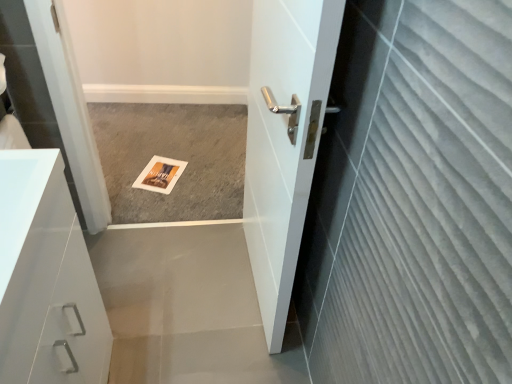
Question: Would you say white glossy cabinet at left is outside white glossy door at center?

Choices:
 (A) no
 (B) yes

Answer: (B)

Question: Is white glossy cabinet at left bigger than white glossy door at center?

Choices:
 (A) no
 (B) yes

Answer: (A)

Question: Are white glossy cabinet at left and white glossy door at center making contact?

Choices:
 (A) yes
 (B) no

Answer: (B)

Question: Is white glossy cabinet at left positioned far away from white glossy door at center?

Choices:
 (A) yes
 (B) no

Answer: (B)

Question: Could you tell me if white glossy cabinet at left is turned towards white glossy door at center?

Choices:
 (A) yes
 (B) no

Answer: (B)

Question: Considering their positions, is gray carpet at center located in front of or behind white glossy cabinet at left?

Choices:
 (A) behind
 (B) front

Answer: (A)

Question: Is gray carpet at center to the left or to the right of white glossy cabinet at left in the image?

Choices:
 (A) left
 (B) right

Answer: (B)

Question: From the image's perspective, is gray carpet at center located above or below white glossy cabinet at left?

Choices:
 (A) above
 (B) below

Answer: (A)

Question: From a real-world perspective, relative to white glossy cabinet at left, is gray carpet at center vertically above or below?

Choices:
 (A) below
 (B) above

Answer: (A)

Question: Is white glossy door at center to the left or to the right of gray carpet at center in the image?

Choices:
 (A) left
 (B) right

Answer: (B)

Question: In terms of height, does white glossy door at center look taller or shorter compared to gray carpet at center?

Choices:
 (A) short
 (B) tall

Answer: (B)

Question: Is white glossy door at center wider or thinner than gray carpet at center?

Choices:
 (A) thin
 (B) wide

Answer: (A)

Question: From a real-world perspective, is white glossy door at center positioned above or below gray carpet at center?

Choices:
 (A) below
 (B) above

Answer: (B)

Question: From their relative heights in the image, would you say white glossy cabinet at left is taller or shorter than white glossy door at center?

Choices:
 (A) tall
 (B) short

Answer: (B)

Question: Is white glossy cabinet at left situated inside white glossy door at center or outside?

Choices:
 (A) inside
 (B) outside

Answer: (B)